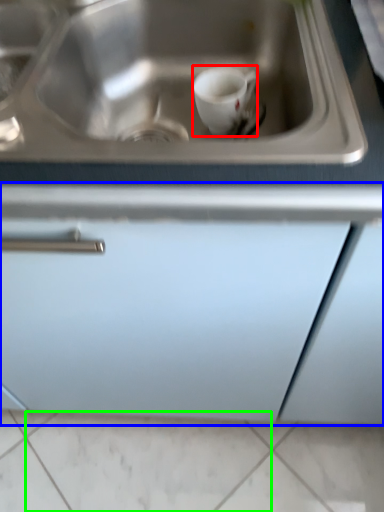
Question: Which object is the farthest from coffee cup (highlighted by a red box)? Choose among these: cabinetry (highlighted by a blue box) or tile (highlighted by a green box).

Choices:
 (A) cabinetry
 (B) tile

Answer: (B)